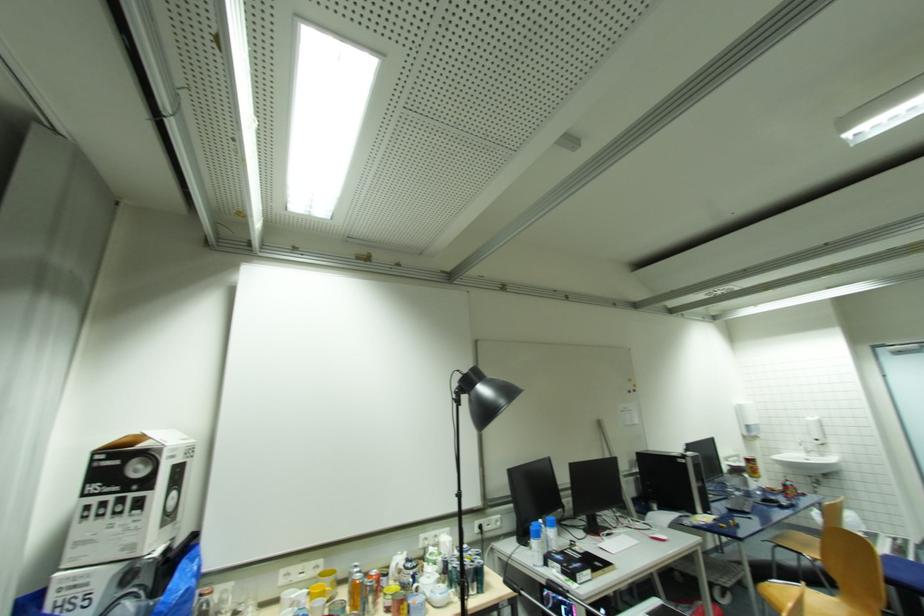
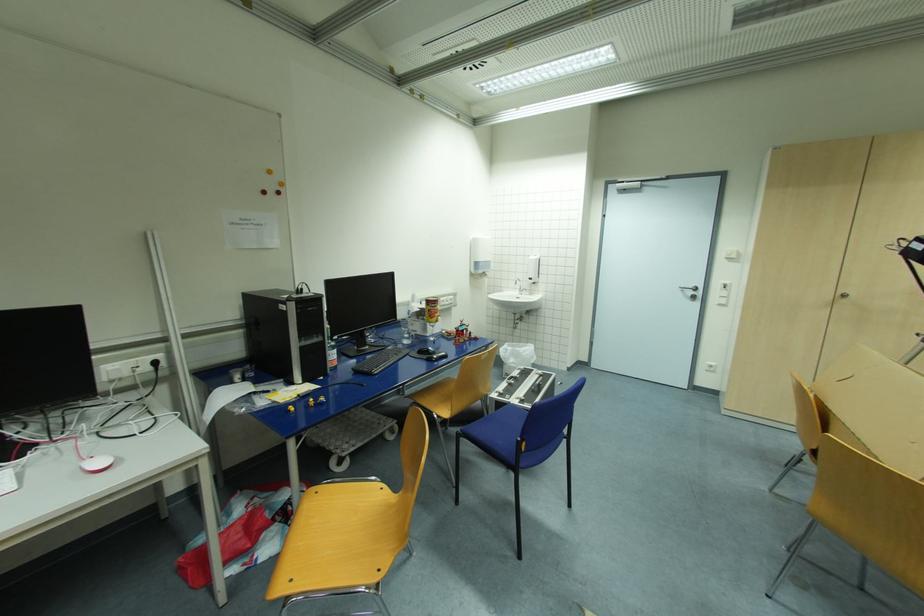
Locate, in the second image, the point that corresponds to (x=821, y=440) in the first image.

(533, 280)